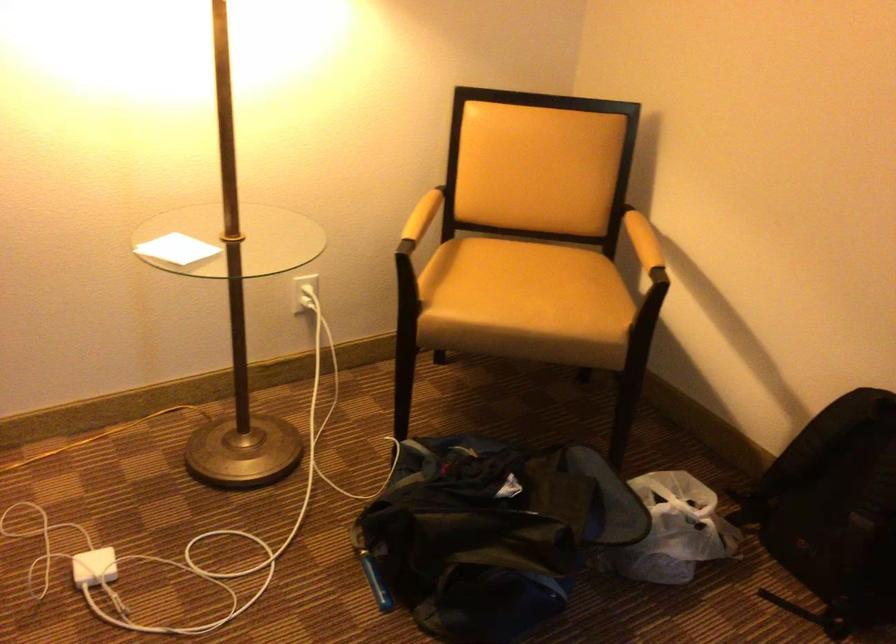
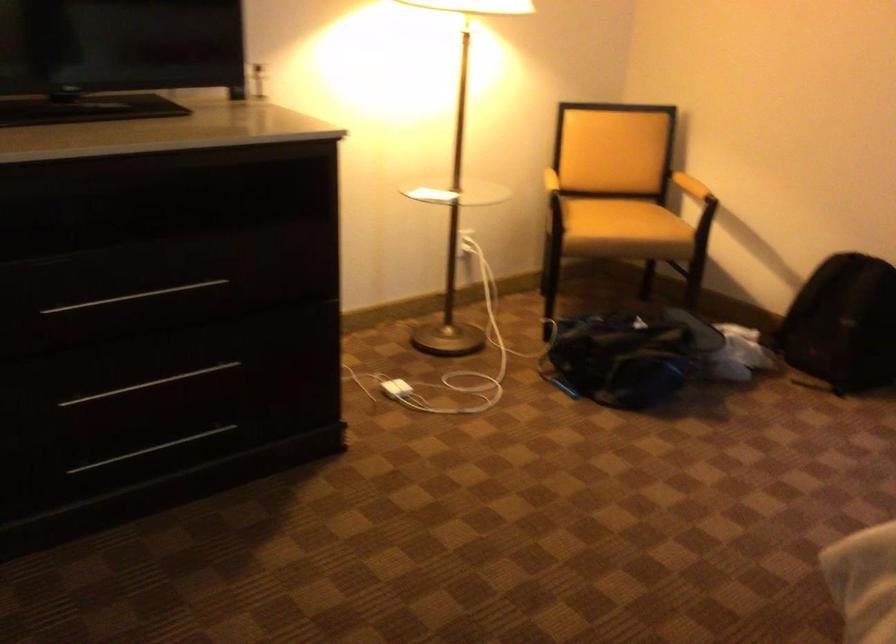
The point at (645, 254) is marked in the first image. Where is the corresponding point in the second image?

(690, 185)